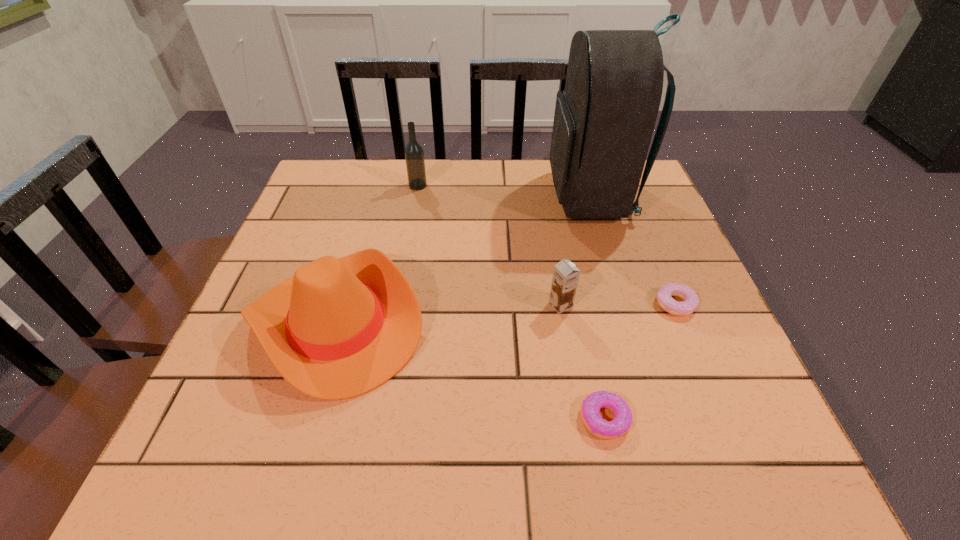
Identify the location of the tallest object. (604, 119).

Where is `the fifth shortest object`? the fifth shortest object is located at coordinates (414, 155).

Locate an element on the screen. cowboy hat is located at coordinates (340, 327).

Image resolution: width=960 pixels, height=540 pixels. What are the coordinates of `chocolate milk` in the screenshot? It's located at (565, 278).

Where is `the right doughnut`? the right doughnut is located at coordinates 690,304.

Find the location of a particular element. the nearer doughnut is located at coordinates (590, 408).

You are a GUI agent. You are given a task and a screenshot of the screen. Output one action in this format:
    pyautogui.click(x=<x>, y=<y>)
    Task: Click on the free space located on the front-facing side of the tallest object
    
    Given the screenshot: What is the action you would take?
    pyautogui.click(x=466, y=197)

The image size is (960, 540). What are the coordinates of `vacant space located on the front-facing side of the tallest object` in the screenshot? It's located at (473, 197).

Find the location of `blank space located on the front-facing side of the tallest object`. blank space located on the front-facing side of the tallest object is located at coordinates (446, 197).

The height and width of the screenshot is (540, 960). I want to click on blank space located on the right of the vodka, so click(533, 186).